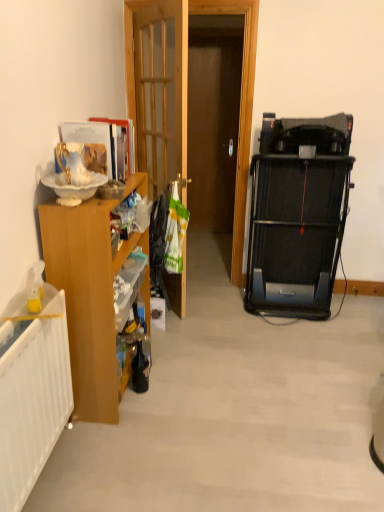
Locate an element on the screen. wooden at left is located at coordinates (158, 86).

What do you see at coordinates (158, 86) in the screenshot?
I see `wooden at left` at bounding box center [158, 86].

Where is `wooden cabinet at left`? The height and width of the screenshot is (512, 384). wooden cabinet at left is located at coordinates (88, 298).

What do you see at coordinates (88, 298) in the screenshot?
I see `wooden cabinet at left` at bounding box center [88, 298].

The height and width of the screenshot is (512, 384). I want to click on wooden at left, so click(x=158, y=86).

Which is more to the right, wooden cabinet at left or wooden at left?

From the viewer's perspective, wooden at left appears more on the right side.

Which is in front, wooden cabinet at left or wooden at left?

Positioned in front is wooden cabinet at left.

Does point (85, 216) come farther from viewer compared to point (128, 34)?

No, (85, 216) is closer to viewer.

From the image's perspective, which object appears higher, wooden cabinet at left or wooden at left?

wooden at left appears higher in the image.

From a real-world perspective, relative to wooden at left, is wooden cabinet at left vertically above or below?

In terms of real-world spatial position, wooden cabinet at left is below wooden at left.

Is wooden cabinet at left wider or thinner than wooden at left?

wooden cabinet at left is wider than wooden at left.

Who is taller, wooden cabinet at left or wooden at left?

wooden at left is taller.

Considering the relative sizes of wooden cabinet at left and wooden at left in the image provided, is wooden cabinet at left smaller than wooden at left?

Incorrect, wooden cabinet at left is not smaller in size than wooden at left.

Does wooden cabinet at left contain wooden at left?

Actually, wooden at left is outside wooden cabinet at left.

Is wooden cabinet at left beside wooden at left?

No, wooden cabinet at left is not beside wooden at left.

Is wooden cabinet at left aimed at wooden at left?

No, wooden cabinet at left is not facing towards wooden at left.

How different are the orientations of wooden cabinet at left and wooden at left in degrees?

wooden cabinet at left and wooden at left are facing 34 degrees away from each other.

Identify the location of door located on the right of wooden cabinet at left. (158, 86).

Is wooden at left to the left of wooden cabinet at left from the viewer's perspective?

No, wooden at left is not to the left of wooden cabinet at left.

Between wooden at left and wooden cabinet at left, which one is positioned behind?

wooden at left is behind.

Which is closer to the camera, (154, 69) or (118, 408)?

Point (154, 69).

From the image's perspective, is wooden at left below wooden cabinet at left?

Actually, wooden at left appears above wooden cabinet at left in the image.

From a real-world perspective, relative to wooden cabinet at left, is wooden at left vertically above or below?

From a real-world perspective, wooden at left is physically above wooden cabinet at left.

Which of these two, wooden at left or wooden cabinet at left, is wider?

With larger width is wooden cabinet at left.

Which of these two, wooden at left or wooden cabinet at left, stands shorter?

wooden cabinet at left.

Based on their sizes in the image, would you say wooden at left is bigger or smaller than wooden cabinet at left?

Considering their sizes, wooden at left takes up less space than wooden cabinet at left.

Can we say wooden at left lies outside wooden cabinet at left?

Yes, wooden at left is outside of wooden cabinet at left.

Is wooden at left touching wooden cabinet at left?

wooden at left and wooden cabinet at left are not in contact.

Is wooden at left positioned with its back to wooden cabinet at left?

No, wooden at left is not facing away from wooden cabinet at left.

Looking at this image, how many degrees apart are the facing directions of wooden at left and wooden cabinet at left?

wooden at left and wooden cabinet at left are facing 34 degrees away from each other.

This screenshot has width=384, height=512. What are the coordinates of `door located above the wooden cabinet at left (from the image's perspective)` in the screenshot? It's located at (158, 86).

Image resolution: width=384 pixels, height=512 pixels. What are the coordinates of `door that appears on the right of wooden cabinet at left` in the screenshot? It's located at (158, 86).

This screenshot has height=512, width=384. I want to click on door above the wooden cabinet at left (from the image's perspective), so click(x=158, y=86).